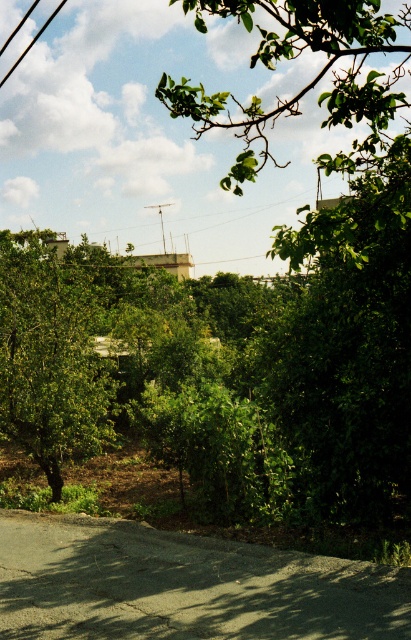
You are a hiker who wants to take a photo of the metallic pole at center without the green leafy tree at left blocking it. Which direction should you move to achieve this?

The green leafy tree at left is in front of the metallic pole at center, so you should move to the right side of the scene to position yourself where the tree no longer blocks the view of the metallic pole at center.

You are standing on the paved road in the foreground of this outdoor scene. There are two points marked on the road. One is at coordinates point (108,412) and the other is at point (163,224). Which point is nearer to you?

Point (108,412) is closer to the viewer than point (163,224).